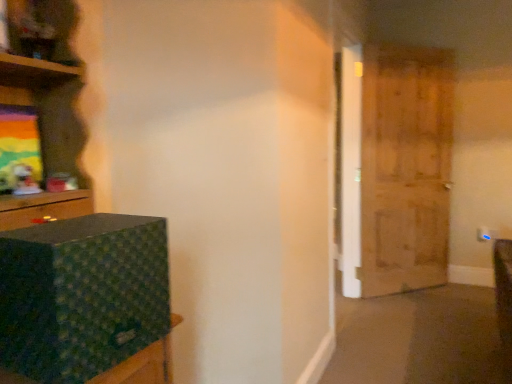
Question: In terms of size, does wooden door at right appear bigger or smaller than green fabric box at left?

Choices:
 (A) big
 (B) small

Answer: (A)

Question: Is wooden door at right taller or shorter than green fabric box at left?

Choices:
 (A) short
 (B) tall

Answer: (B)

Question: Is wooden door at right spatially inside green fabric box at left, or outside of it?

Choices:
 (A) outside
 (B) inside

Answer: (A)

Question: Based on their sizes in the image, would you say green fabric box at left is bigger or smaller than wooden door at right?

Choices:
 (A) small
 (B) big

Answer: (A)

Question: Would you say green fabric box at left is inside or outside wooden door at right?

Choices:
 (A) inside
 (B) outside

Answer: (B)

Question: In the image, is green fabric box at left on the left side or the right side of wooden door at right?

Choices:
 (A) left
 (B) right

Answer: (A)

Question: From a real-world perspective, is green fabric box at left positioned above or below wooden door at right?

Choices:
 (A) below
 (B) above

Answer: (A)